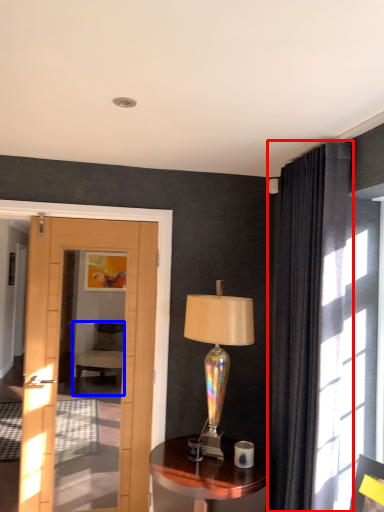
Question: Among these objects, which one is nearest to the camera, curtain (highlighted by a red box) or chair (highlighted by a blue box)?

Choices:
 (A) curtain
 (B) chair

Answer: (A)